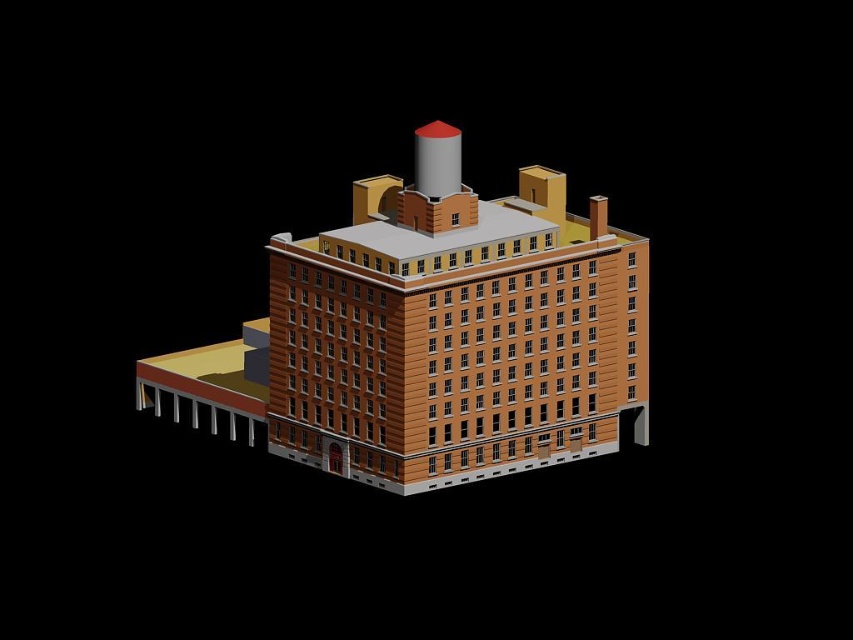
Is brown brick building at center further to the viewer compared to metallic silver chimney at upper center?

No.

Who is taller, brown brick building at center or metallic silver chimney at upper center?

Standing taller between the two is brown brick building at center.

Locate an element on the screen. brown brick building at center is located at coordinates (434, 339).